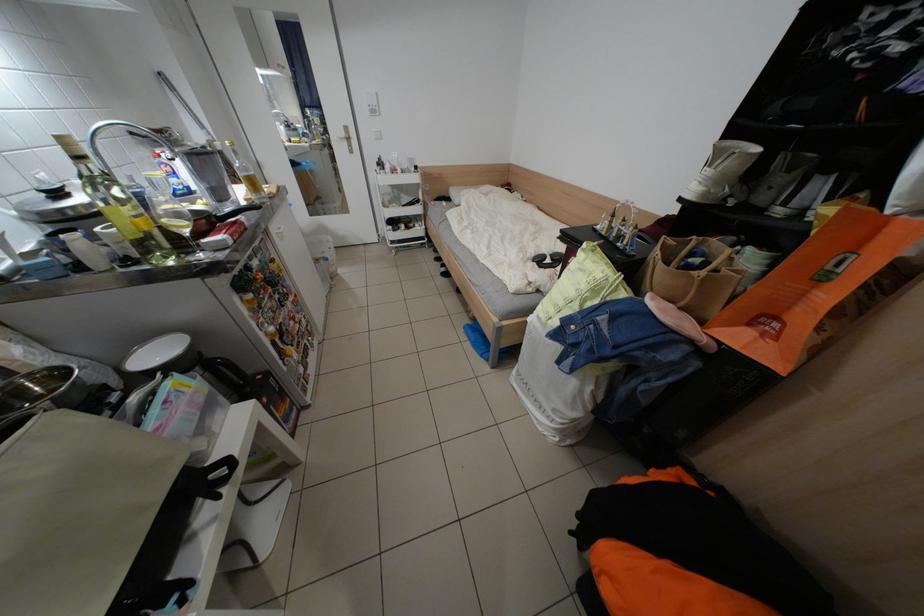
Locate an element on the screen. The image size is (924, 616). black pan handle is located at coordinates (214, 477).